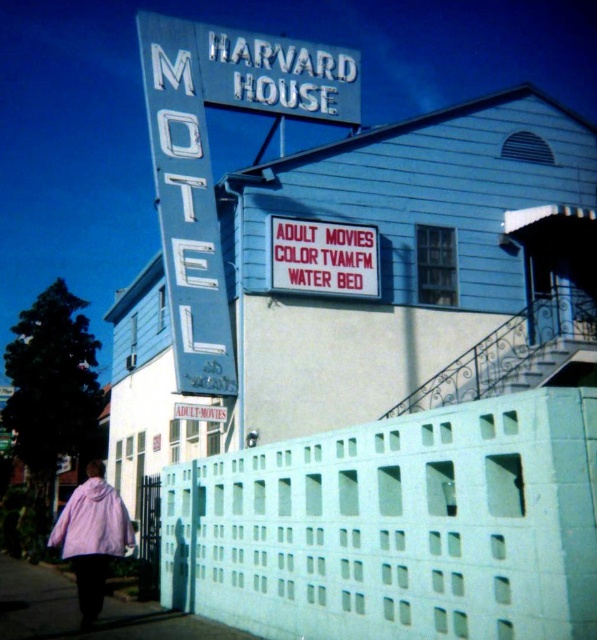
Who is lower down, light blue concrete fence at lower center or metallic blue motel sign at upper center?

light blue concrete fence at lower center is lower down.

Is light blue concrete fence at lower center thinner than metallic blue motel sign at upper center?

Yes, light blue concrete fence at lower center is thinner than metallic blue motel sign at upper center.

Describe the element at coordinates (396, 525) in the screenshot. This screenshot has height=640, width=597. I see `light blue concrete fence at lower center` at that location.

This screenshot has height=640, width=597. In order to click on light blue concrete fence at lower center in this screenshot , I will do pos(396,525).

Does light blue concrete fence at lower center have a smaller size compared to red plastic sign at upper center?

Indeed, light blue concrete fence at lower center has a smaller size compared to red plastic sign at upper center.

Who is shorter, light blue concrete fence at lower center or red plastic sign at upper center?

Standing shorter between the two is light blue concrete fence at lower center.

Does point (273, 580) lie behind point (310, 282)?

No, (273, 580) is closer to viewer.

Find the location of `light blue concrete fence at lower center`. light blue concrete fence at lower center is located at coordinates [396, 525].

Who is taller, light blue concrete fence at lower center or smooth concrete pavement at lower left?

Standing taller between the two is smooth concrete pavement at lower left.

Where is `light blue concrete fence at lower center`? The image size is (597, 640). light blue concrete fence at lower center is located at coordinates (396, 525).

Locate an element on the screen. light blue concrete fence at lower center is located at coordinates (396, 525).